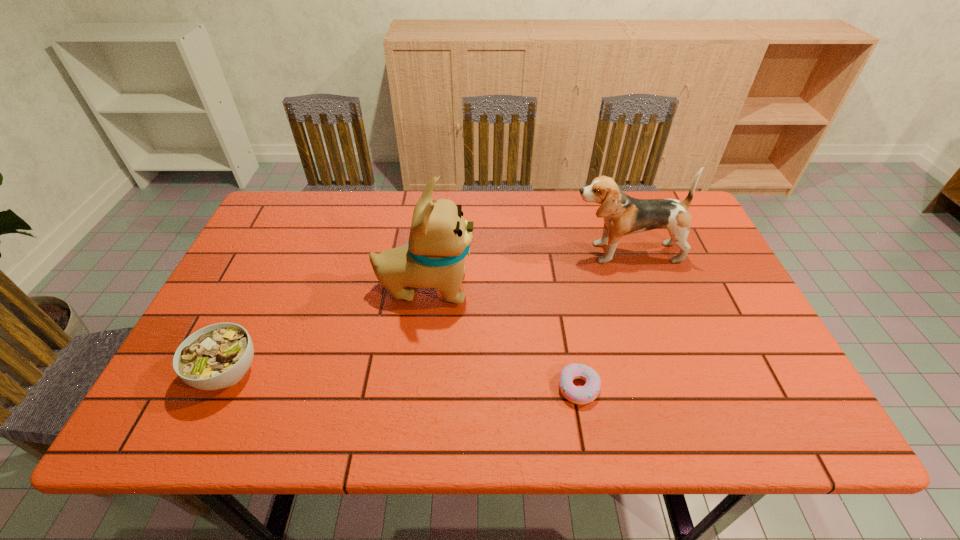
What are the coordinates of `empty location between the farther puppy and the second shortest object` in the screenshot? It's located at (426, 313).

This screenshot has height=540, width=960. What are the coordinates of `free spot between the farthest object and the leftmost object` in the screenshot? It's located at (426, 313).

Find the location of `object that is the nearest to the farthest object`. object that is the nearest to the farthest object is located at coordinates (440, 237).

Locate an element on the screen. object that is the third closest to the farthest object is located at coordinates (217, 356).

Locate an element on the screen. The image size is (960, 540). vacant area that satisfies the following two spatial constraints: 1. on the front side of the doughnut; 2. on the left side of the third tallest object is located at coordinates (220, 388).

Locate an element on the screen. Image resolution: width=960 pixels, height=540 pixels. vacant space that satisfies the following two spatial constraints: 1. at the face of the farthest object; 2. on the front side of the shortest object is located at coordinates (671, 388).

Where is `free location that satisfies the following two spatial constraints: 1. on the face of the second object from left to right; 2. on the back side of the shortest object`? The width and height of the screenshot is (960, 540). free location that satisfies the following two spatial constraints: 1. on the face of the second object from left to right; 2. on the back side of the shortest object is located at coordinates (414, 388).

Where is `free space that satisfies the following two spatial constraints: 1. on the face of the left puppy; 2. on the left side of the shortest object`? The image size is (960, 540). free space that satisfies the following two spatial constraints: 1. on the face of the left puppy; 2. on the left side of the shortest object is located at coordinates (414, 388).

The height and width of the screenshot is (540, 960). Find the location of `vacant space that satisfies the following two spatial constraints: 1. on the face of the left puppy; 2. on the back side of the shortest object`. vacant space that satisfies the following two spatial constraints: 1. on the face of the left puppy; 2. on the back side of the shortest object is located at coordinates (414, 388).

Locate an element on the screen. Image resolution: width=960 pixels, height=540 pixels. vacant position in the image that satisfies the following two spatial constraints: 1. on the front side of the soup bowl; 2. on the right side of the doughnut is located at coordinates (220, 388).